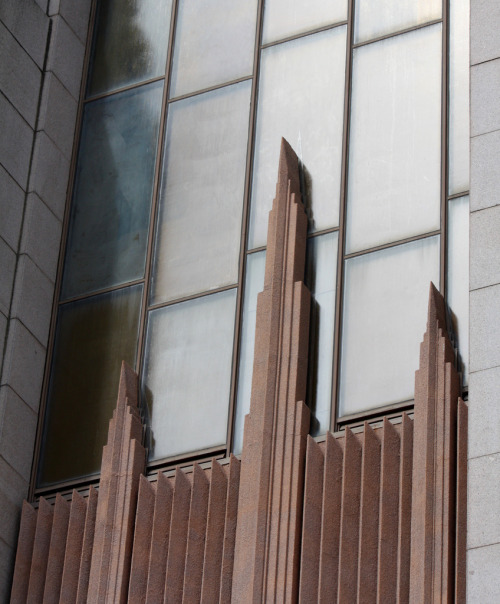
The image size is (500, 604). I want to click on glass, so click(116, 206).